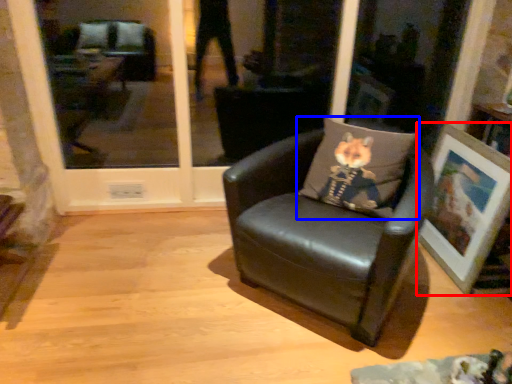
Question: Which of the following is the farthest to the observer, picture frame (highlighted by a red box) or pillow (highlighted by a blue box)?

Choices:
 (A) picture frame
 (B) pillow

Answer: (A)